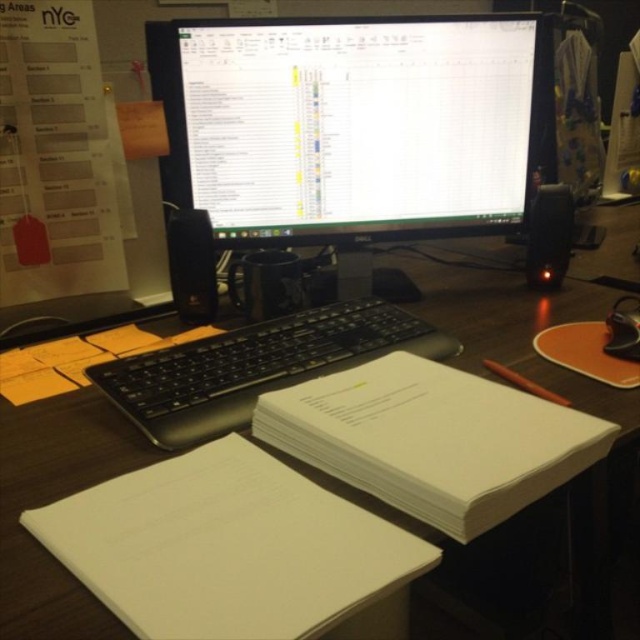
Does white paper notebook at center have a greater height compared to wooden desk at center?

In fact, white paper notebook at center may be shorter than wooden desk at center.

Who is lower down, white paper notebook at center or wooden desk at center?

white paper notebook at center

What do you see at coordinates (433, 440) in the screenshot? I see `white paper notebook at center` at bounding box center [433, 440].

The width and height of the screenshot is (640, 640). I want to click on white paper notebook at center, so click(433, 440).

Which is below, white glossy monitor at center or white paper notebook at center?

white paper notebook at center

Does point (163, 172) lie in front of point (611, 428)?

That is False.

Between point (273, 51) and point (500, 445), which one is positioned behind?

The point (273, 51) is behind.

Find the location of a particular element. Image resolution: width=640 pixels, height=640 pixels. white glossy monitor at center is located at coordinates 349,124.

Is white paper notebook at lower center bigger than wooden desk at center?

No.

This screenshot has height=640, width=640. What do you see at coordinates (227, 547) in the screenshot?
I see `white paper notebook at lower center` at bounding box center [227, 547].

Who is more forward, (205, 536) or (28, 625)?

Point (28, 625) is more forward.

Locate an element on the screen. This screenshot has height=640, width=640. white paper notebook at lower center is located at coordinates (227, 547).